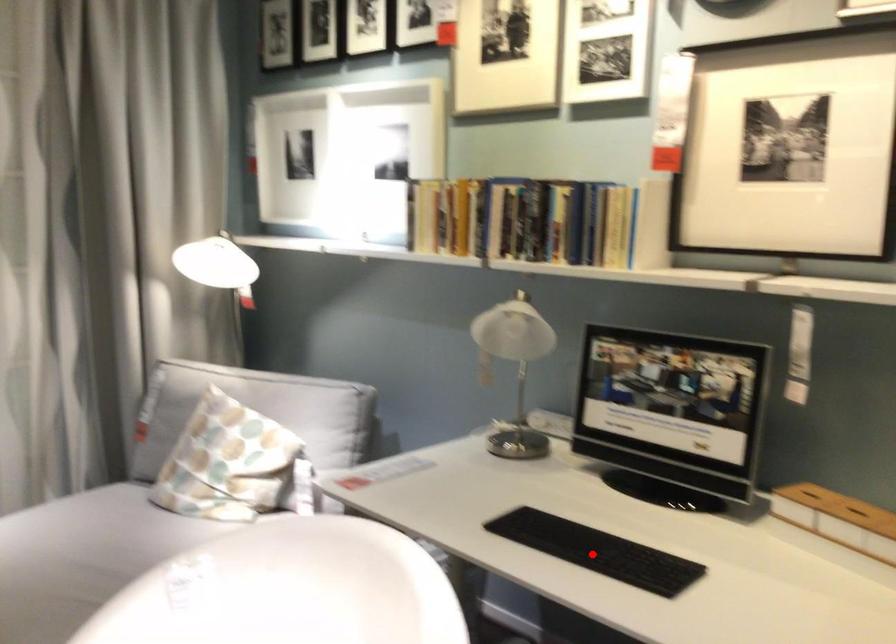
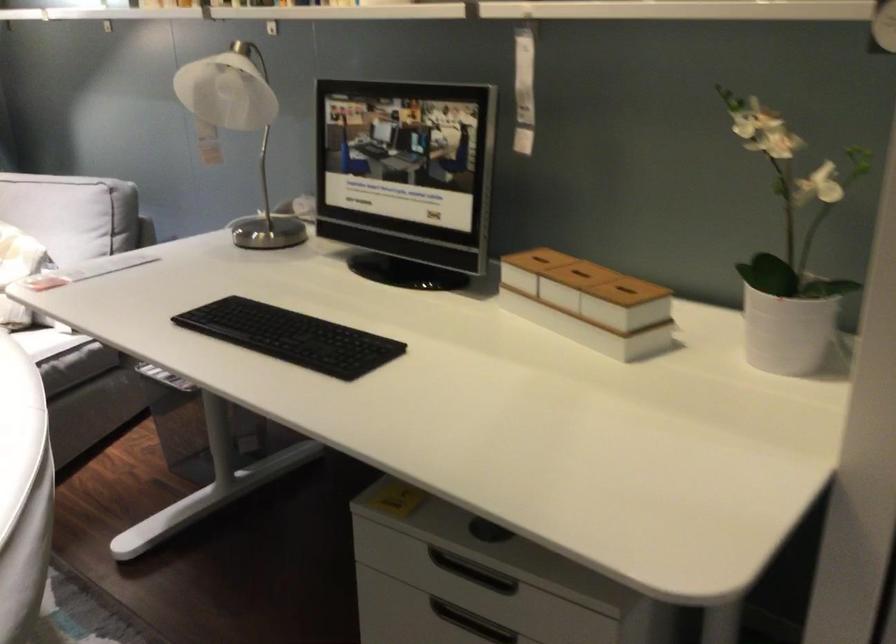
Question: I am providing you with two images of the same scene from different viewpoints. A red point is shown in image1. For the corresponding object point in image2, is it positioned nearer or farther from the camera?

Choices:
 (A) Nearer
 (B) Farther

Answer: (A)